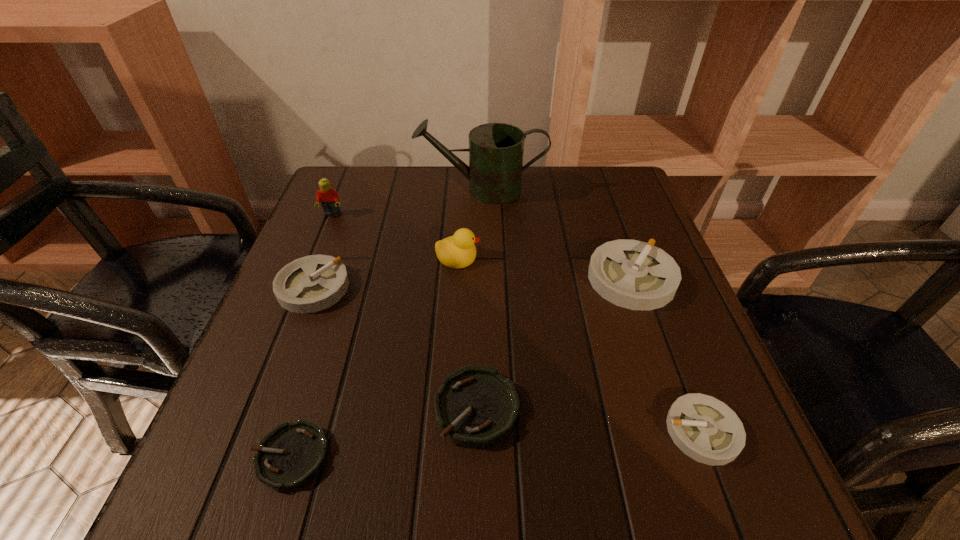
Locate an element on the screen. This screenshot has width=960, height=540. object present at the near right corner is located at coordinates (704, 428).

Locate an element on the screen. vacant position at the far edge of the desktop is located at coordinates (412, 217).

Find the location of a particular element. The height and width of the screenshot is (540, 960). free point at the left edge is located at coordinates (321, 357).

This screenshot has height=540, width=960. In order to click on vacant region at the right edge of the desktop in this screenshot , I will do `click(683, 367)`.

Identify the location of free location at the far left corner of the desktop. Image resolution: width=960 pixels, height=540 pixels. (368, 168).

Image resolution: width=960 pixels, height=540 pixels. In order to click on vacant space at the near left corner of the desktop in this screenshot , I will do `click(216, 467)`.

Where is `vacant space at the far right corner of the desktop`? The height and width of the screenshot is (540, 960). vacant space at the far right corner of the desktop is located at coordinates (622, 201).

The height and width of the screenshot is (540, 960). I want to click on vacant area that lies between the third tallest object and the second farthest object, so click(396, 235).

The width and height of the screenshot is (960, 540). Find the location of `vacant space in between the second tallest object and the smaller green ashtray`. vacant space in between the second tallest object and the smaller green ashtray is located at coordinates (312, 335).

The height and width of the screenshot is (540, 960). Find the location of `unoccupied position between the yellow duckling and the smallest gray ashtray`. unoccupied position between the yellow duckling and the smallest gray ashtray is located at coordinates (581, 344).